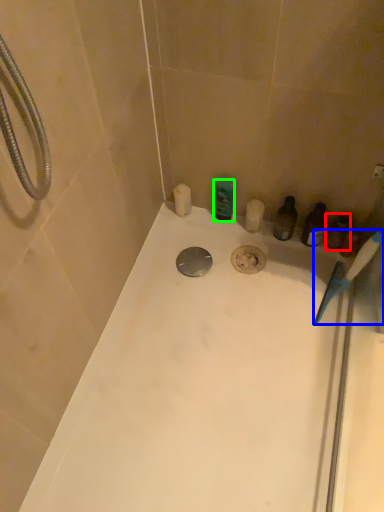
Question: Based on their relative distances, which object is nearer to toiletry (highlighted by a red box)? Choose from toothbrush (highlighted by a blue box) and toiletry (highlighted by a green box).

Choices:
 (A) toothbrush
 (B) toiletry

Answer: (A)